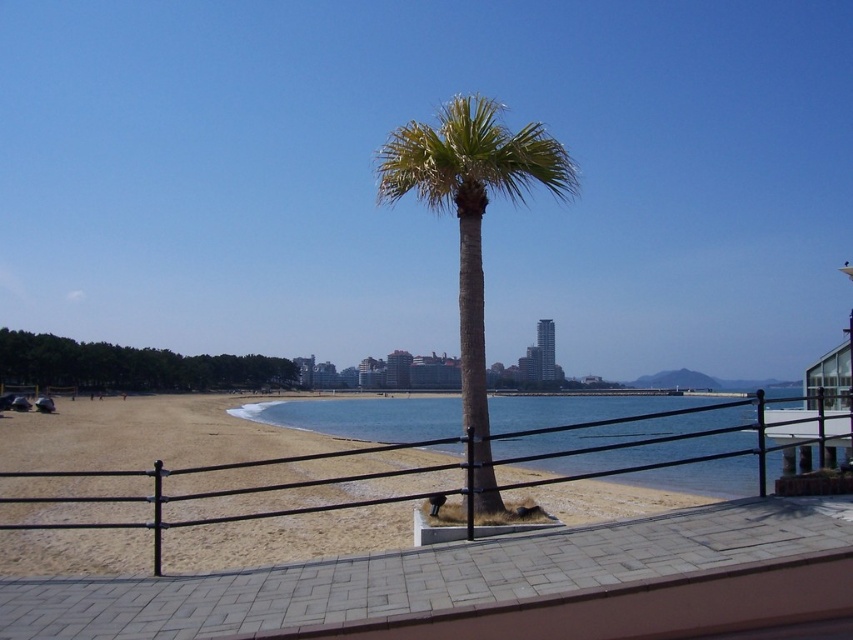
You are standing on the beach and want to take a photo of the clear blue water at center without the black metal fence at center blocking the view. How should you position yourself relative to the fence and the water?

The black metal fence at center is located above the clear blue water at center. To avoid the fence blocking the view, you should position yourself below the fence, facing towards the water so that the fence is above you and not in the frame.

You are standing on the beach and see the black metal fence at center and the clear blue water at center. Which object is located to the right of the other?

The clear blue water at center is located to the right of the black metal fence at center because the black metal fence at center is positioned on the left side of clear blue water at center.